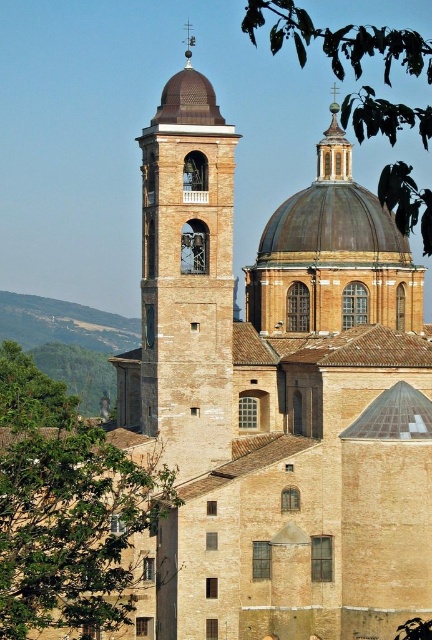
Question: Among these objects, which one is nearest to the camera?

Choices:
 (A) green leafy tree at left
 (B) beige stone bell tower at center

Answer: (A)

Question: Which of these objects is positioned closest to the green leafy tree at left?

Choices:
 (A) green leafy tree at upper center
 (B) beige stone bell tower at center

Answer: (B)

Question: Is the position of green leafy tree at left less distant than that of beige stone bell tower at center?

Choices:
 (A) no
 (B) yes

Answer: (B)

Question: Is green leafy tree at left smaller than beige stone bell tower at center?

Choices:
 (A) no
 (B) yes

Answer: (B)

Question: Does green leafy tree at left appear under beige stone bell tower at center?

Choices:
 (A) no
 (B) yes

Answer: (B)

Question: Which object is closer to the camera taking this photo?

Choices:
 (A) green leafy tree at left
 (B) green leafy tree at upper center

Answer: (B)